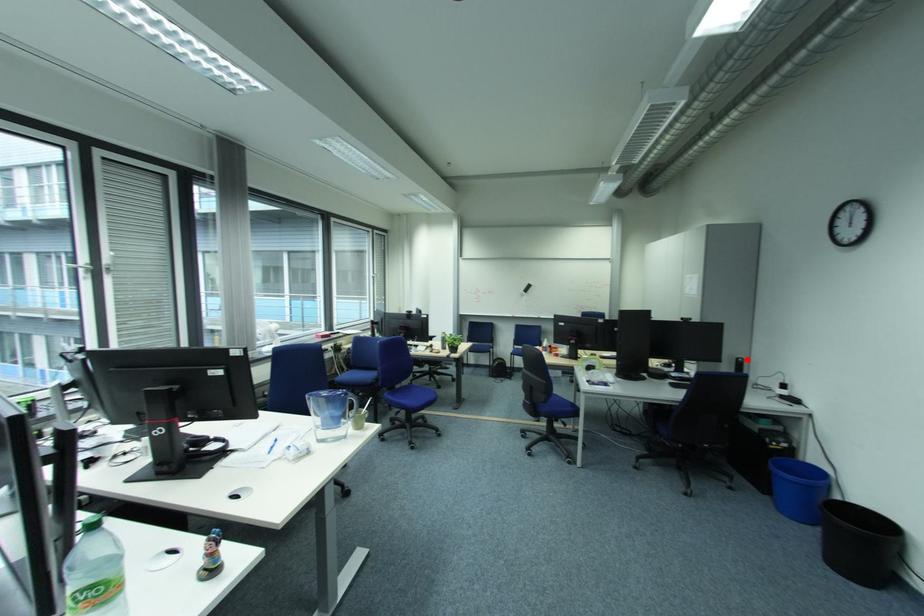
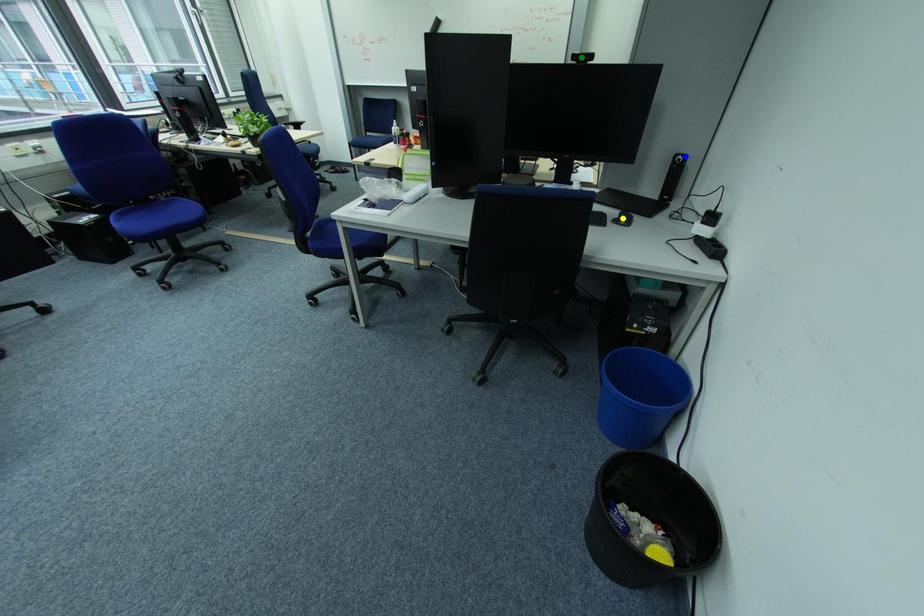
Question: I am providing you with two images of the same scene from different viewpoints. A red point is marked on the first image. You are given multiple points on the second image. Which spot in image 2 lines up with the point in image 1?

Choices:
 (A) green point
 (B) yellow point
 (C) blue point

Answer: (C)